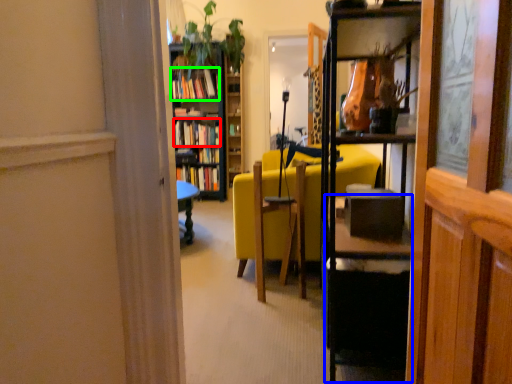
Question: Which object is positioned farthest from book (highlighted by a red box)? Select from table (highlighted by a blue box) and book (highlighted by a green box).

Choices:
 (A) table
 (B) book

Answer: (A)